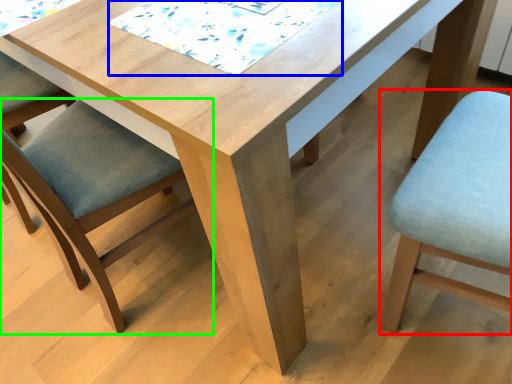
Question: Which is farther away from chair (highlighted by a red box)? quilt (highlighted by a blue box) or chair (highlighted by a green box)?

Choices:
 (A) quilt
 (B) chair

Answer: (B)